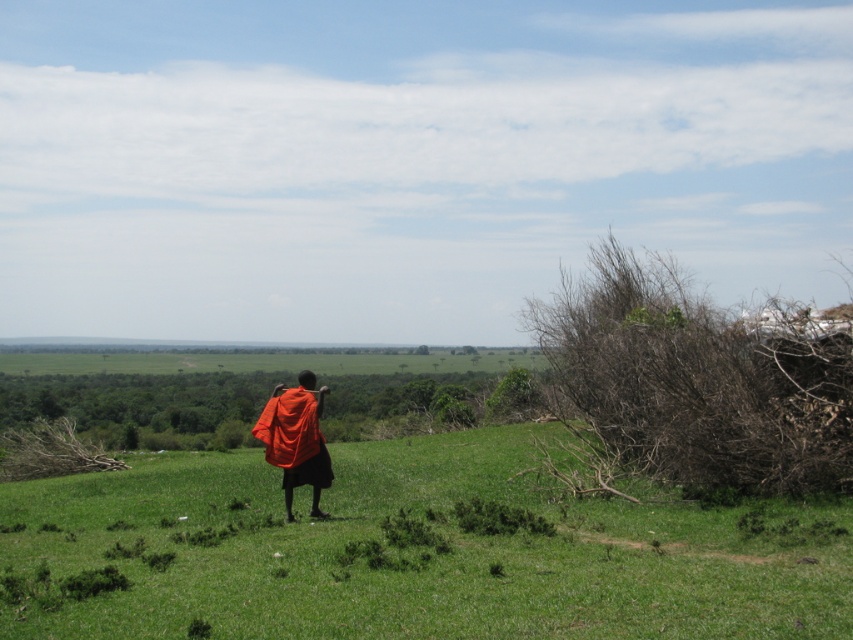
You are standing on the grassy hill and want to place the orange fabric shawl at center on top of the green grassy at center. Will the shawl be completely visible from above?

The green grassy at center is taller than the orange fabric shawl at center, so the shawl will not be completely visible from above as it will be partially obscured by the grass.

Based on the photo, you are standing on the grassy hill and see the orange fabric shawl at center and the green grassy at center. Which object is positioned to the right of the other?

The green grassy at center is to the right of orange fabric shawl at center.